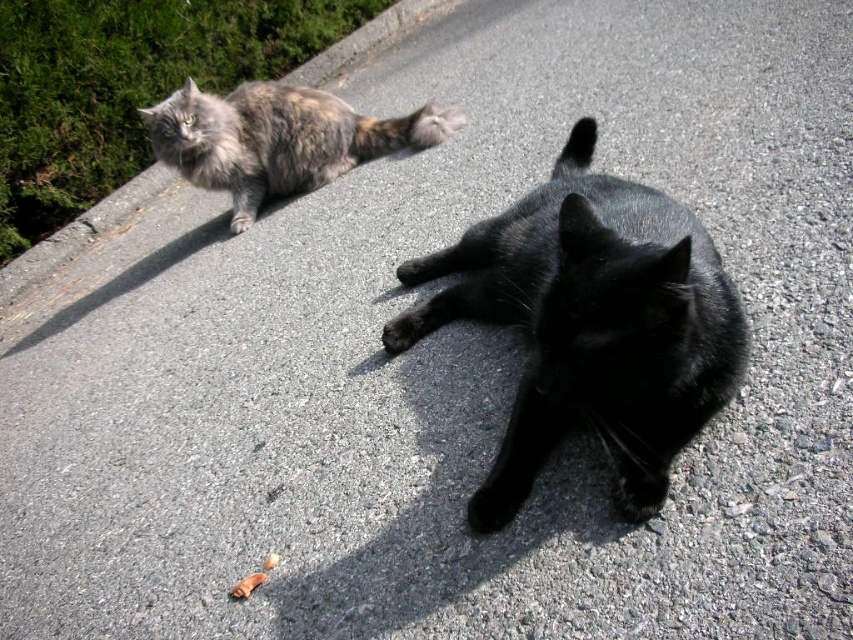
Question: Which point appears farthest from the camera in this image?

Choices:
 (A) (229, 152)
 (B) (621, 362)

Answer: (A)

Question: Is black glossy cat at center to the left of tabby fur cat at upper left from the viewer's perspective?

Choices:
 (A) no
 (B) yes

Answer: (A)

Question: Does black glossy cat at center appear under tabby fur cat at upper left?

Choices:
 (A) yes
 (B) no

Answer: (A)

Question: Considering the relative positions of black glossy cat at center and tabby fur cat at upper left in the image provided, where is black glossy cat at center located with respect to tabby fur cat at upper left?

Choices:
 (A) below
 (B) above

Answer: (A)

Question: Which point is closer to the camera?

Choices:
 (A) (196, 116)
 (B) (579, 230)

Answer: (B)